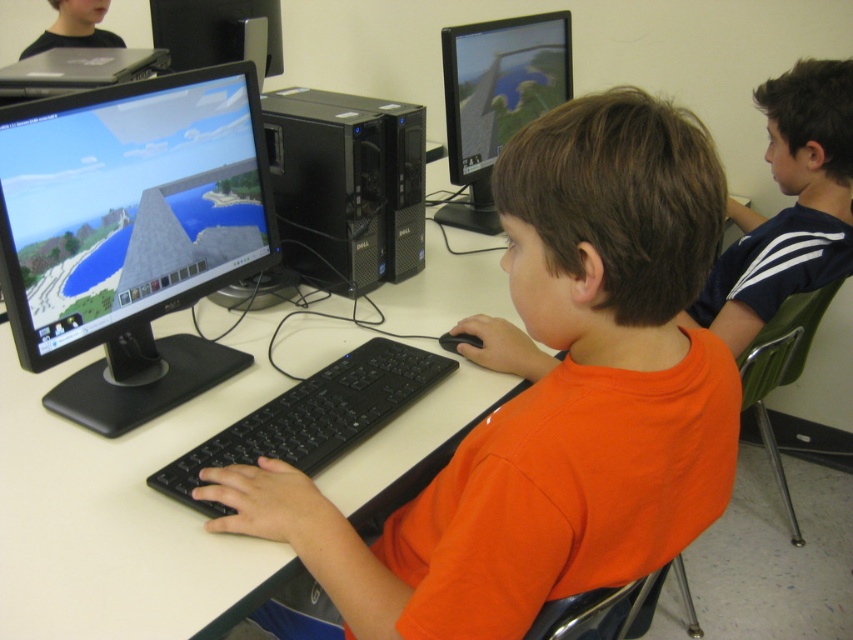
Can you confirm if black plastic keyboard at center is taller than matte black monitor at upper center?

No, black plastic keyboard at center is not taller than matte black monitor at upper center.

What do you see at coordinates (312, 417) in the screenshot?
I see `black plastic keyboard at center` at bounding box center [312, 417].

Which is behind, point (410, 401) or point (465, 179)?

Point (465, 179)

This screenshot has height=640, width=853. What are the coordinates of `black plastic keyboard at center` in the screenshot? It's located at (312, 417).

Does black plastic monitor at center have a larger size compared to black plastic computer tower at center?

Correct, black plastic monitor at center is larger in size than black plastic computer tower at center.

Is black plastic monitor at center shorter than black plastic computer tower at center?

No, black plastic monitor at center is not shorter than black plastic computer tower at center.

Measure the distance between point (62,307) and camera.

Point (62,307) is 3.63 feet from camera.

Find the location of a particular element. The height and width of the screenshot is (640, 853). black plastic monitor at center is located at coordinates 131,234.

Is black plastic monitor at center smaller than black plastic keyboard at center?

Actually, black plastic monitor at center might be larger than black plastic keyboard at center.

Does black plastic monitor at center have a lesser width compared to black plastic keyboard at center?

Yes.

Locate an element on the screen. This screenshot has height=640, width=853. black plastic monitor at center is located at coordinates (131, 234).

You are a GUI agent. You are given a task and a screenshot of the screen. Output one action in this format:
    pyautogui.click(x=<x>, y=<y>)
    Task: Click on the black plastic monitor at center
    
    Given the screenshot: What is the action you would take?
    pyautogui.click(x=131, y=234)